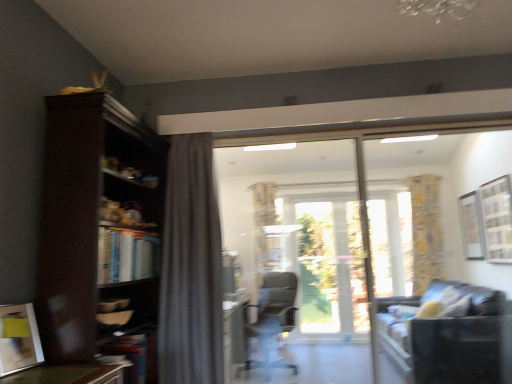
Question: Can you confirm if transparent glass screen door at center is taller than yellow floral fabric curtain at right, the first curtain from the right?

Choices:
 (A) yes
 (B) no

Answer: (A)

Question: From a real-world perspective, does transparent glass screen door at center stand above yellow floral fabric curtain at right, the first curtain from the right?

Choices:
 (A) yes
 (B) no

Answer: (B)

Question: Is transparent glass screen door at center to the right of yellow floral fabric curtain at right, which is counted as the 1th curtain, starting from the back, from the viewer's perspective?

Choices:
 (A) yes
 (B) no

Answer: (B)

Question: Considering the relative sizes of transparent glass screen door at center and yellow floral fabric curtain at right, which is the 2th curtain in left-to-right order, in the image provided, is transparent glass screen door at center thinner than yellow floral fabric curtain at right, which is the 2th curtain in left-to-right order,?

Choices:
 (A) yes
 (B) no

Answer: (A)

Question: Is transparent glass screen door at center placed right next to yellow floral fabric curtain at right, the second curtain when ordered from front to back?

Choices:
 (A) yes
 (B) no

Answer: (B)

Question: Is transparent glass screen door at center completely or partially outside of yellow floral fabric curtain at right, which is the 2th curtain in left-to-right order?

Choices:
 (A) no
 (B) yes

Answer: (B)

Question: Is transparent glass screen door at center located outside dark wood bookcase at left?

Choices:
 (A) yes
 (B) no

Answer: (A)

Question: Does transparent glass screen door at center have a greater height compared to dark wood bookcase at left?

Choices:
 (A) no
 (B) yes

Answer: (B)

Question: Does transparent glass screen door at center turn towards dark wood bookcase at left?

Choices:
 (A) no
 (B) yes

Answer: (A)

Question: Is transparent glass screen door at center at the left side of dark wood bookcase at left?

Choices:
 (A) no
 (B) yes

Answer: (A)

Question: From the image's perspective, is transparent glass screen door at center on top of dark wood bookcase at left?

Choices:
 (A) no
 (B) yes

Answer: (A)

Question: Is transparent glass screen door at center bigger than dark wood bookcase at left?

Choices:
 (A) yes
 (B) no

Answer: (B)

Question: Is clear glass window at upper right aimed at yellow floral fabric curtain at right, which is the 2th curtain in left-to-right order?

Choices:
 (A) yes
 (B) no

Answer: (B)